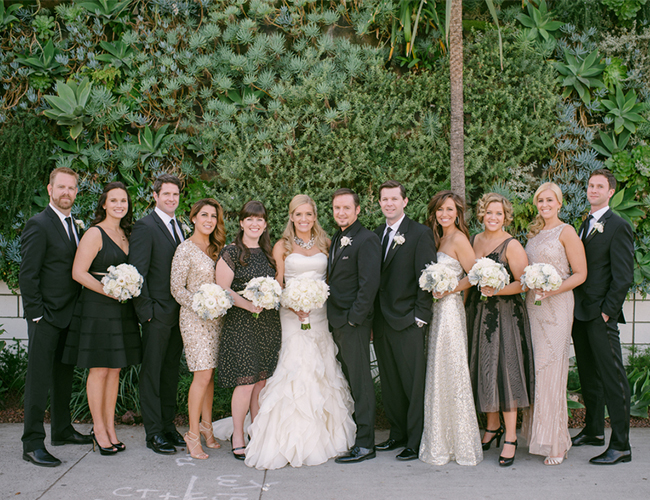
You are a GUI agent. You are given a task and a screenshot of the screen. Output one action in this format:
    pyautogui.click(x=<x>, y=<y>)
    Task: Click on the floral bouquets
    
    Given the screenshot: What is the action you would take?
    pyautogui.click(x=534, y=275), pyautogui.click(x=491, y=275), pyautogui.click(x=417, y=277), pyautogui.click(x=318, y=297), pyautogui.click(x=270, y=296), pyautogui.click(x=220, y=302), pyautogui.click(x=125, y=292)